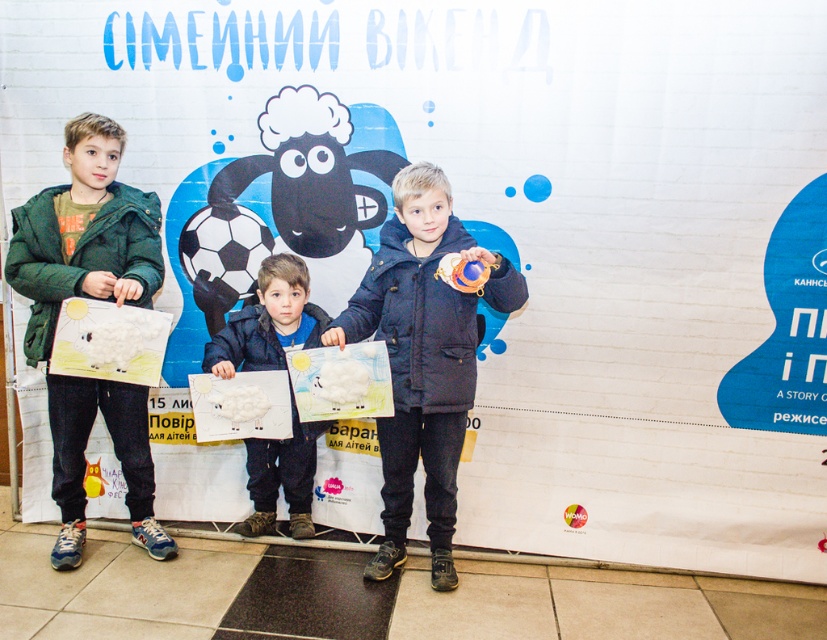
You are a photographer setting up for a group photo. You notice the green matte jacket at left and the dark blue jacket at center. Which jacket takes up more horizontal space in the frame?

The dark blue jacket at center has a greater width than the green matte jacket at left, so it takes up more horizontal space in the frame.

You are organizing a photo shoot and need to decide where to place a new prop. The green matte jacket at left and the matte white paper at center are already positioned. Which object takes up more space in the image?

The green matte jacket at left has a larger size compared to the matte white paper at center, so it takes up more space in the image.

You are a photographer who needs to adjust the distance between the children to ensure they are all in focus. The camera you are using has a depth of field that can cover 2.5 meters. Given the current distance between the green matte jacket at left and the other children, will you need to adjust their positions?

The children are 2.62 meters apart, which exceeds the camera depth of field of 2.5 meters. Therefore, you need to move them closer to ensure they are all in focus.